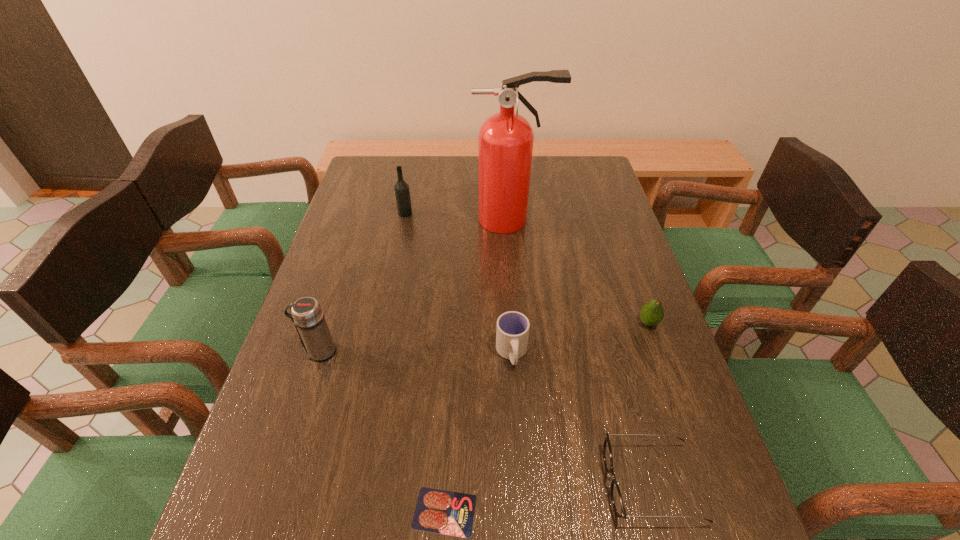
Where is `free space located 0.330m on the front of the third farthest object`? This screenshot has height=540, width=960. free space located 0.330m on the front of the third farthest object is located at coordinates (700, 467).

In order to click on vacant area situated through the lenses of the second shortest object in this screenshot , I will do point(520,483).

At what (x,y) coordinates should I click in order to perform the action: click on free region located through the lenses of the second shortest object. Please return your answer as a coordinate pair (x, y). The height and width of the screenshot is (540, 960). Looking at the image, I should click on (553, 483).

This screenshot has height=540, width=960. In order to click on vacant point located through the lenses of the second shortest object in this screenshot , I will do `click(440, 483)`.

This screenshot has width=960, height=540. I want to click on vacant area situated on the back of the salami, so (453, 347).

Identify the location of object that is at the left edge. (307, 315).

Where is `avocado that is at the right edge`? avocado that is at the right edge is located at coordinates (652, 313).

Identify the location of spectacles present at the right edge. (616, 497).

This screenshot has width=960, height=540. Find the location of `vacant region at the far edge`. vacant region at the far edge is located at coordinates (472, 167).

Identify the location of vacant space at the left edge of the desktop. This screenshot has width=960, height=540. (326, 464).